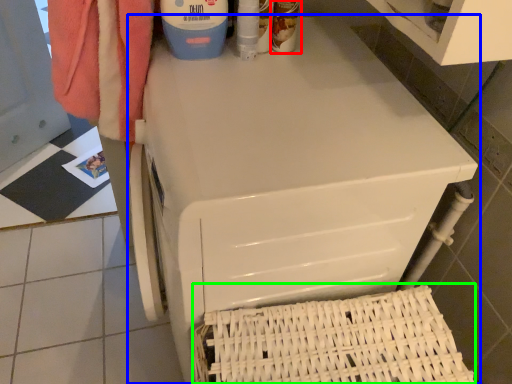
Question: Based on their relative distances, which object is nearer to cleaning product (highlighted by a red box)? Choose from home appliance (highlighted by a blue box) and basket (highlighted by a green box).

Choices:
 (A) home appliance
 (B) basket

Answer: (A)